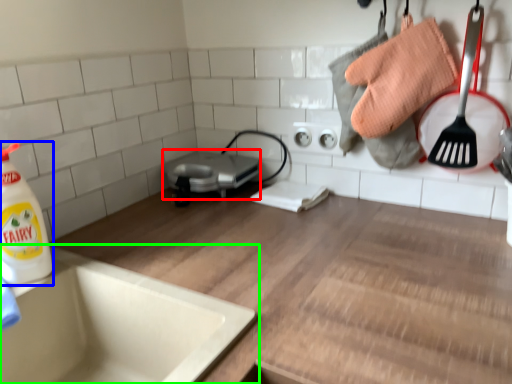
Question: Which is farther away from appliance (highlighted by a red box)? cleaning product (highlighted by a blue box) or sink (highlighted by a green box)?

Choices:
 (A) cleaning product
 (B) sink

Answer: (A)